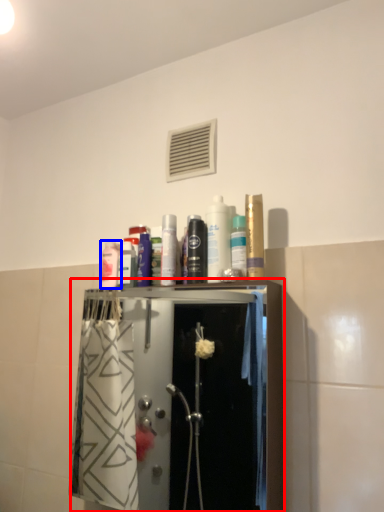
Question: Which object is closer to the camera taking this photo, closet (highlighted by a red box) or toiletry (highlighted by a blue box)?

Choices:
 (A) closet
 (B) toiletry

Answer: (A)